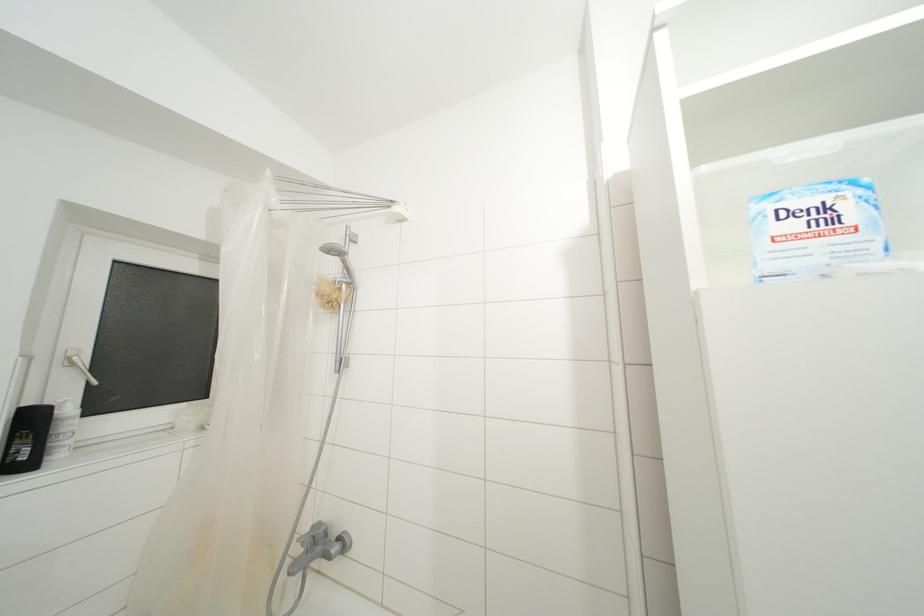
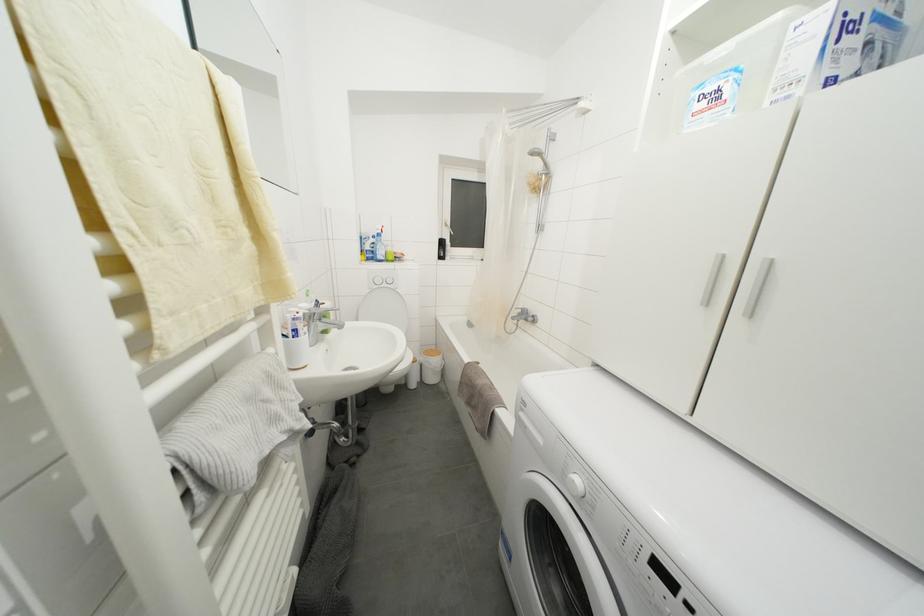
The images are taken continuously from a first-person perspective. In which direction is your viewpoint rotating?

The camera rotated toward left-down.